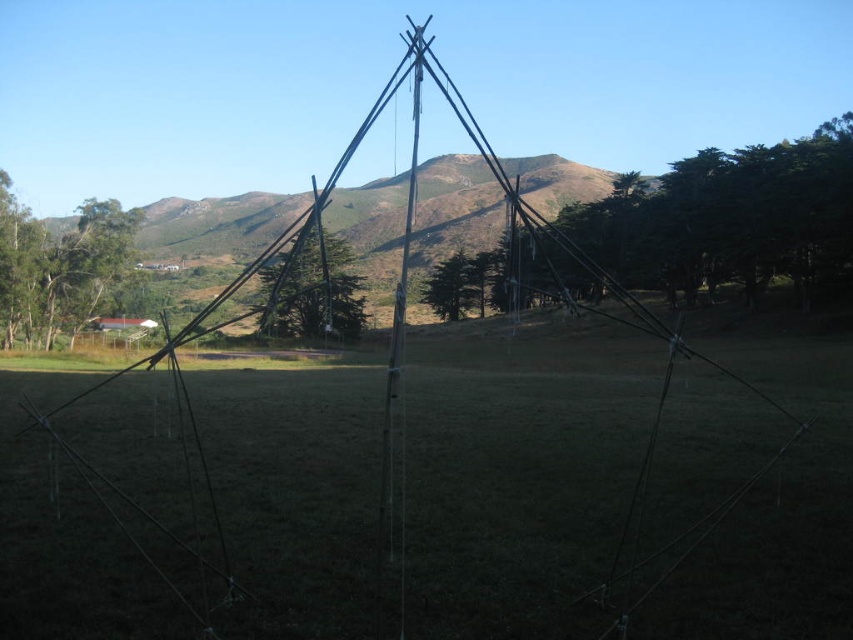
Can you confirm if green leafy tree at center is thinner than green matte tree at left?

No.

Does green leafy tree at center lie in front of green matte tree at left?

Yes.

Locate an element on the screen. green leafy tree at center is located at coordinates (730, 220).

Identify the location of green leafy tree at center. (730, 220).

Is point (708, 252) closer to viewer compared to point (270, 202)?

Yes, point (708, 252) is in front of point (270, 202).

Does green leafy tree at center appear on the left side of brown/dry grassy hill at center?

In fact, green leafy tree at center is to the right of brown/dry grassy hill at center.

Identify the location of green leafy tree at center. This screenshot has height=640, width=853. (730, 220).

Identify the location of green leafy tree at center. The height and width of the screenshot is (640, 853). (730, 220).

Is brown/dry grassy hill at center wider than green matte tree at center?

Indeed, brown/dry grassy hill at center has a greater width compared to green matte tree at center.

Which is below, brown/dry grassy hill at center or green matte tree at center?

Positioned lower is green matte tree at center.

Is point (421, 236) farther from camera compared to point (296, 332)?

Yes, it is behind point (296, 332).

What are the coordinates of `brown/dry grassy hill at center` in the screenshot? It's located at (216, 225).